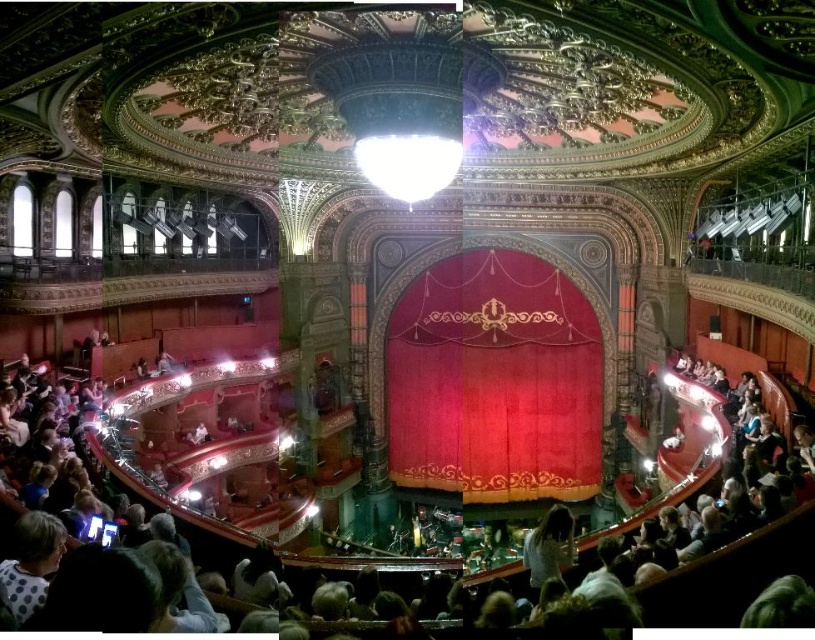
Identify the location of velvet/red curtain at center. (494, 380).

Is point (439, 486) positioned behind point (774, 515)?

That is True.

The image size is (815, 640). In order to click on velvet/red curtain at center in this screenshot , I will do `click(494, 380)`.